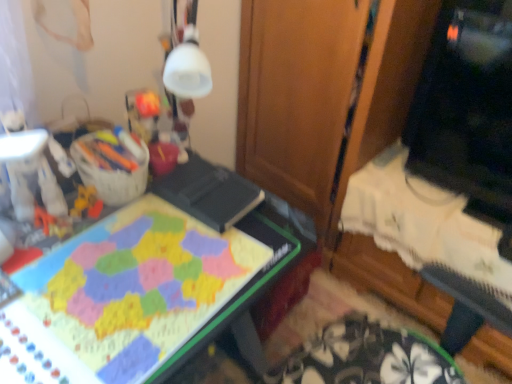
Find the location of a particular element. vacant area that is in front of plush yellow toy at left is located at coordinates (67, 258).